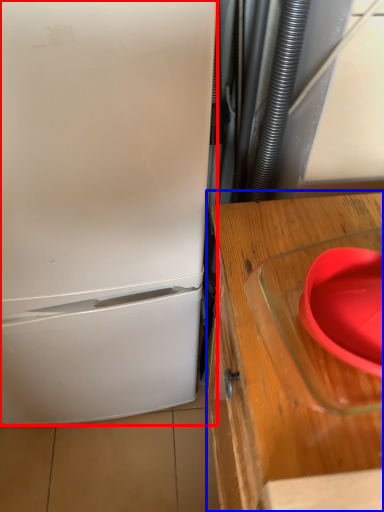
Question: Which object appears farthest to the camera in this image, refrigerator (highlighted by a red box) or table (highlighted by a blue box)?

Choices:
 (A) refrigerator
 (B) table

Answer: (B)